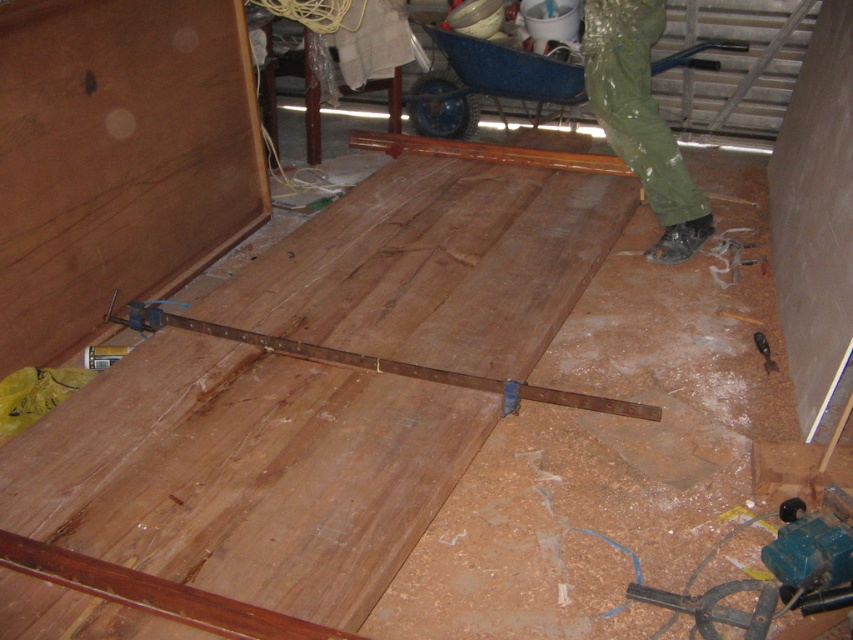
Question: Does rusty metal ruler at center have a greater width compared to metallic blue drill at lower right?

Choices:
 (A) yes
 (B) no

Answer: (A)

Question: Among these points, which one is farthest from the camera?

Choices:
 (A) (663, 163)
 (B) (599, 404)
 (C) (755, 339)

Answer: (A)

Question: Is rusty metal ruler at center below metallic blue drill at lower right?

Choices:
 (A) yes
 (B) no

Answer: (A)

Question: Which object is closer to the camera taking this photo?

Choices:
 (A) rusty metal ruler at center
 (B) green rubber pants at center
 (C) metallic blue drill at lower right

Answer: (A)

Question: Which of the following is the farthest from the observer?

Choices:
 (A) (x=628, y=24)
 (B) (x=753, y=336)
 (C) (x=556, y=403)

Answer: (A)

Question: Is green rubber pants at center wider than rusty metal ruler at center?

Choices:
 (A) yes
 (B) no

Answer: (B)